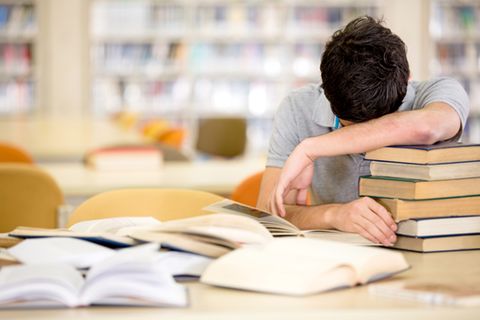
This screenshot has width=480, height=320. In order to click on chair in this screenshot , I will do `click(11, 152)`, `click(16, 186)`, `click(144, 197)`, `click(253, 191)`, `click(175, 140)`, `click(154, 125)`, `click(129, 120)`.